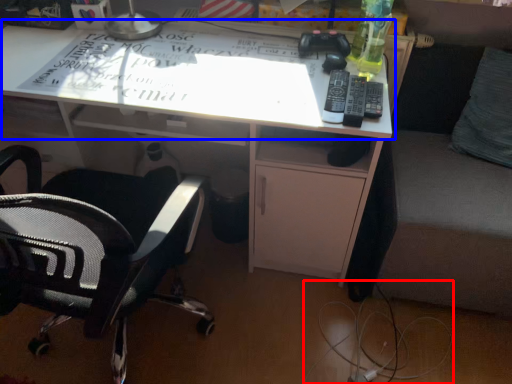
Question: Which object appears closest to the camera in this image, wire (highlighted by a red box) or table top (highlighted by a blue box)?

Choices:
 (A) wire
 (B) table top

Answer: (B)